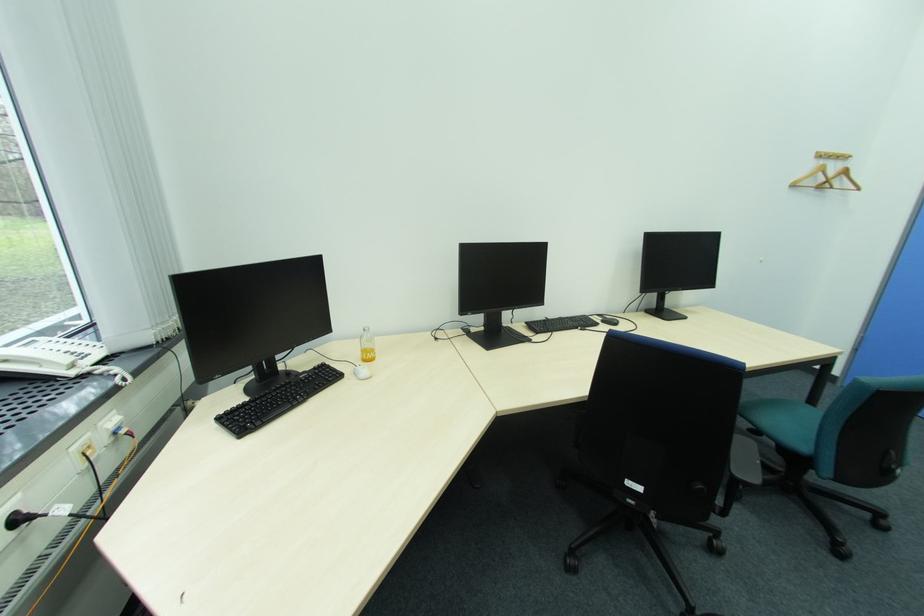
Find where to pull the black power plug. Please return your answer as a coordinate pair (x, y).

(20, 519)